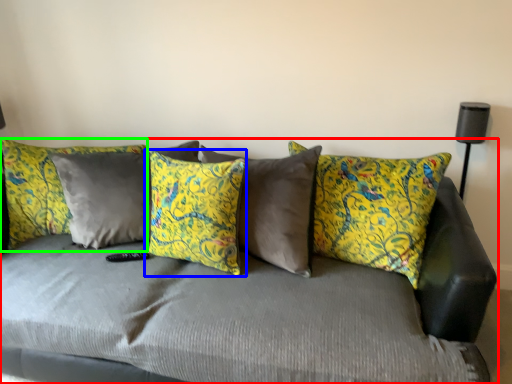
Question: Which object is the closest to the studio couch (highlighted by a red box)? Choose among these: pillow (highlighted by a blue box) or pillow (highlighted by a green box).

Choices:
 (A) pillow
 (B) pillow

Answer: (A)